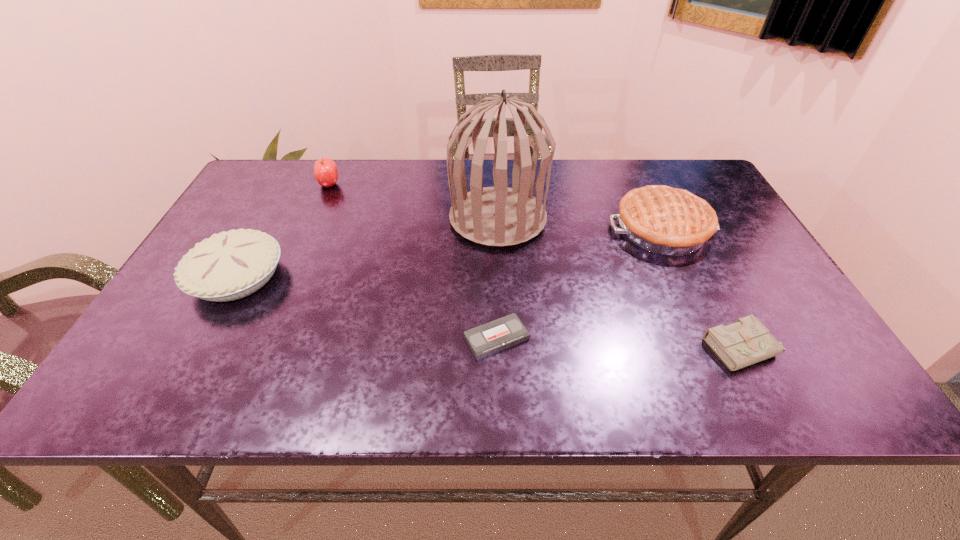
Locate an element on the screen. free space that satisfies the following two spatial constraints: 1. on the back side of the shorter pie; 2. on the left side of the apple is located at coordinates (287, 185).

The image size is (960, 540). I want to click on free space that satisfies the following two spatial constraints: 1. on the front side of the taller pie; 2. on the right side of the tallest object, so click(498, 229).

The height and width of the screenshot is (540, 960). I want to click on free space that satisfies the following two spatial constraints: 1. on the back side of the left pie; 2. on the left side of the taller pie, so click(x=263, y=229).